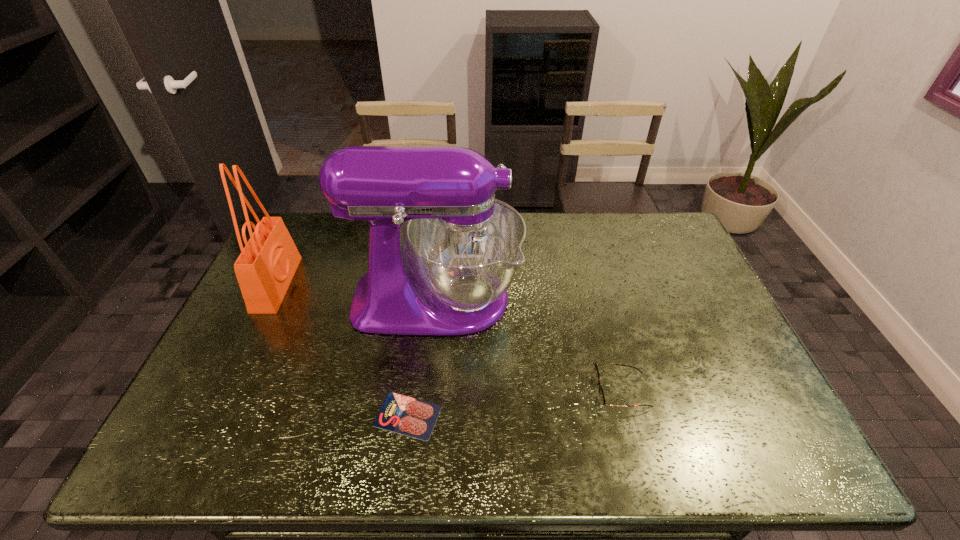
Where is `vacant space in between the mixer and the salami`? vacant space in between the mixer and the salami is located at coordinates (422, 357).

You are a GUI agent. You are given a task and a screenshot of the screen. Output one action in this format:
    pyautogui.click(x=<x>, y=<y>)
    Task: Click on the free point between the second tallest object and the rightmost object
    
    Given the screenshot: What is the action you would take?
    pyautogui.click(x=449, y=338)

You are a GUI agent. You are given a task and a screenshot of the screen. Output one action in this format:
    pyautogui.click(x=<x>, y=<y>)
    Task: Click on the vacant point located between the leftmost object and the spectacles
    This screenshot has height=540, width=960.
    Given the screenshot: What is the action you would take?
    pyautogui.click(x=449, y=338)

Locate an element on the screen. free area in between the tote bag and the spectacles is located at coordinates (449, 338).

Find the location of a particular element. blank region between the salami and the leftmost object is located at coordinates (342, 350).

In order to click on vacant area between the rightmost object and the third shortest object in this screenshot , I will do `click(449, 338)`.

This screenshot has width=960, height=540. What are the coordinates of `object that stands as the third closest to the tote bag` in the screenshot? It's located at (596, 373).

In order to click on the closest object relative to the second shortest object in this screenshot , I will do `click(449, 275)`.

Image resolution: width=960 pixels, height=540 pixels. I want to click on vacant space that satisfies the following two spatial constraints: 1. at the bowl opening of the mixer; 2. on the front side of the shortest object, so click(425, 415).

The width and height of the screenshot is (960, 540). In order to click on free space that satisfies the following two spatial constraints: 1. on the logo side of the salami; 2. on the left side of the third shortest object in this screenshot , I will do `click(213, 415)`.